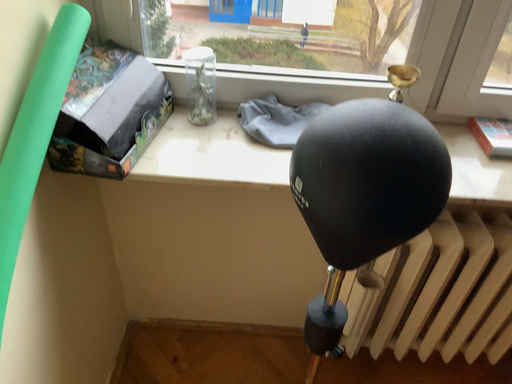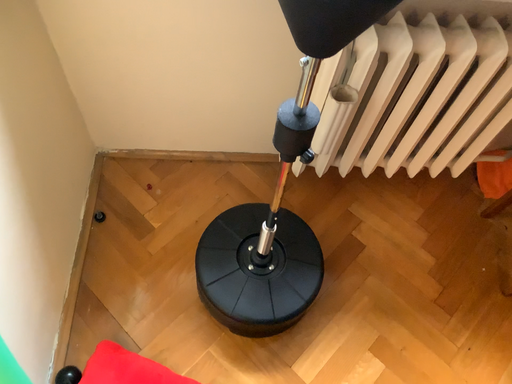
Question: How did the camera likely rotate when shooting the video?

Choices:
 (A) rotated upward
 (B) rotated downward

Answer: (B)